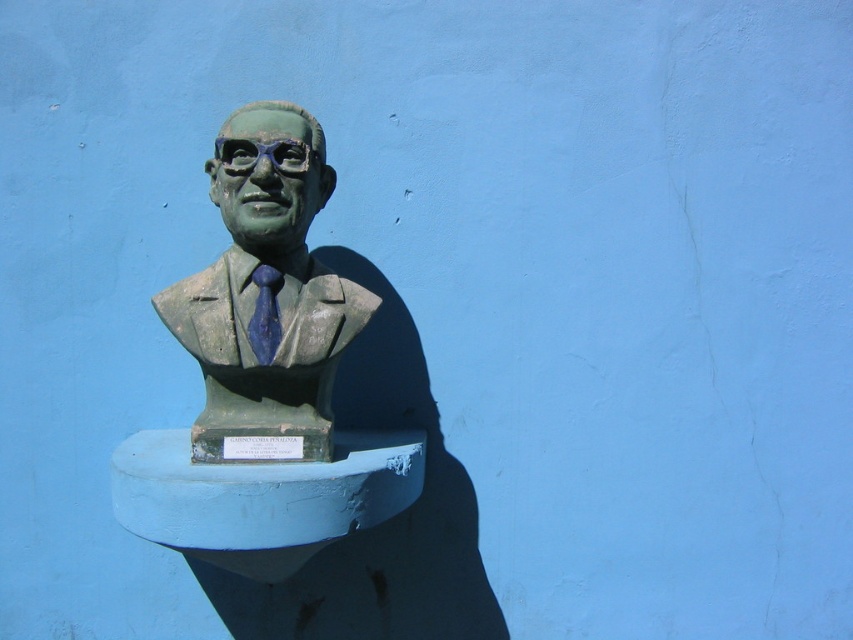
Is point (322, 417) farther from viewer compared to point (297, 160)?

Yes, point (322, 417) is behind point (297, 160).

What are the coordinates of `green stone bust at center` in the screenshot? It's located at (257, 292).

You are a GUI agent. You are given a task and a screenshot of the screen. Output one action in this format:
    pyautogui.click(x=<x>, y=<y>)
    Task: Click on the green stone bust at center
    This screenshot has width=853, height=640.
    Given the screenshot: What is the action you would take?
    pyautogui.click(x=257, y=292)

Measure the distance from green stone bust at center to blue matte tie at center.

The distance of green stone bust at center from blue matte tie at center is 3.14 inches.

In the scene shown: How distant is green stone bust at center from blue matte tie at center?

green stone bust at center is 3.14 inches from blue matte tie at center.

Locate an element on the screen. green stone bust at center is located at coordinates click(257, 292).

Where is `green stone bust at center`? The image size is (853, 640). green stone bust at center is located at coordinates (257, 292).

Who is positioned more to the left, green matte/glossy goggles at center or blue matte tie at center?

green matte/glossy goggles at center

What do you see at coordinates (263, 154) in the screenshot? The width and height of the screenshot is (853, 640). I see `green matte/glossy goggles at center` at bounding box center [263, 154].

Does point (293, 161) come closer to viewer compared to point (268, 291)?

That is True.

Find the location of a particular element. The image size is (853, 640). green matte/glossy goggles at center is located at coordinates (263, 154).